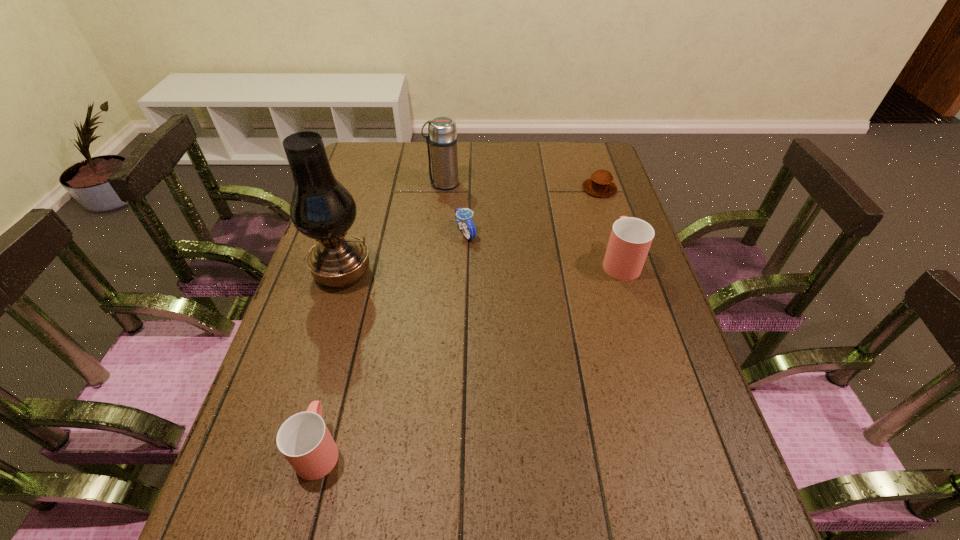
In order to click on the fourth tallest object in this screenshot , I will do `click(304, 439)`.

Image resolution: width=960 pixels, height=540 pixels. I want to click on the nearest object, so click(304, 439).

Where is `the third tallest object`? the third tallest object is located at coordinates (630, 240).

Locate an element on the screen. the taller cup is located at coordinates (630, 240).

Locate an element on the screen. The height and width of the screenshot is (540, 960). oil lamp is located at coordinates (321, 208).

Identify the location of the second tallest object. The image size is (960, 540). (442, 137).

Where is `muffin`? This screenshot has height=540, width=960. muffin is located at coordinates (600, 184).

The image size is (960, 540). What are the coordinates of `watch` in the screenshot? It's located at [x=462, y=215].

Identify the location of free spot located on the side of the shorter cup with the handle. The height and width of the screenshot is (540, 960). (352, 319).

Where is `free space located on the side of the shorter cup with the handle`? free space located on the side of the shorter cup with the handle is located at coordinates (334, 388).